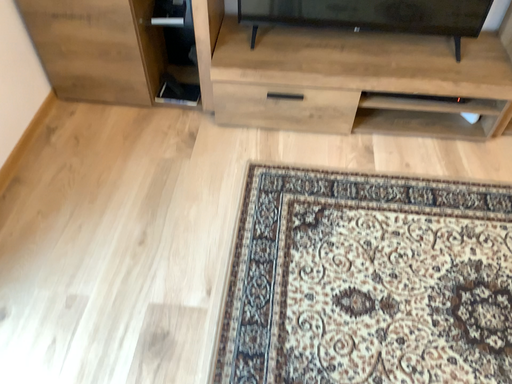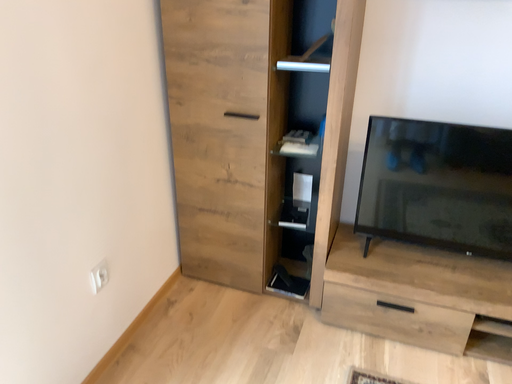
Question: How did the camera likely rotate when shooting the video?

Choices:
 (A) rotated left
 (B) rotated right

Answer: (A)